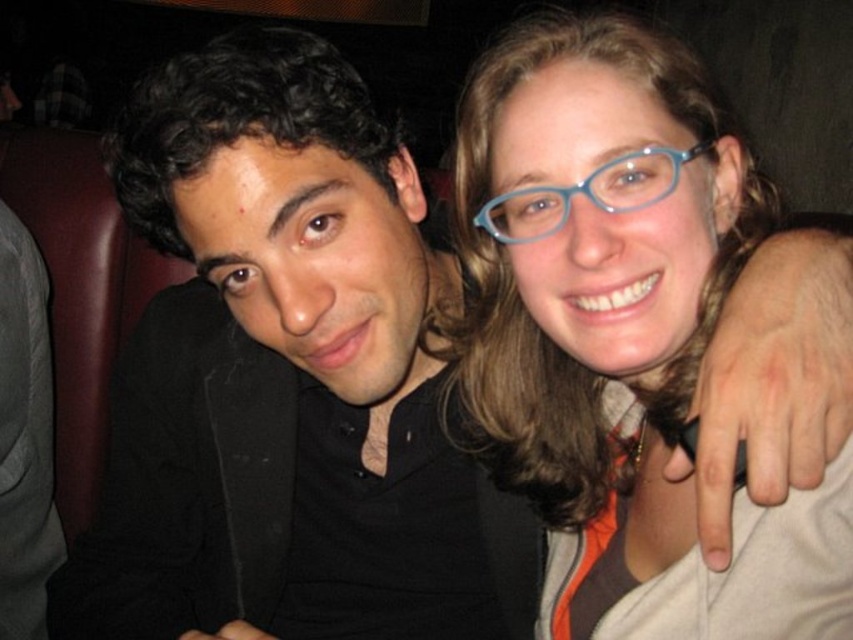
You are a photographer trying to capture a closeup of the black matte jacket at left. The camera you are using has a focal length of 50mm. To ensure the jacket fills the frame, you need to position yourself at a specific distance. Given the jacket is 1 meter tall, what distance should you maintain from the jacket?

The black matte jacket at left is located at point (288,380) in 2D coordinates. However, without knowing the sensor size or the camera sensor dimensions, it is impossible to calculate the exact distance required for the jacket to fill the frame. Please provide more information about the camera sensor size to proceed.

You are a photographer trying to capture a closeup of the blue plastic glasses at upper right without including the black matte jacket at left in the frame. Based on their positions, is this possible?

The black matte jacket at left is located below the blue plastic glasses at upper right, so it is possible to frame the blue plastic glasses at upper right without including the black matte jacket at left by focusing on the upper area where the glasses are positioned.

You are a photographer setting up for a group photo. You notice the black matte jacket at left and the blue plastic glasses at upper center in the frame. Which object is positioned lower in the image?

The black matte jacket at left is positioned below the blue plastic glasses at upper center, so it is lower in the image.